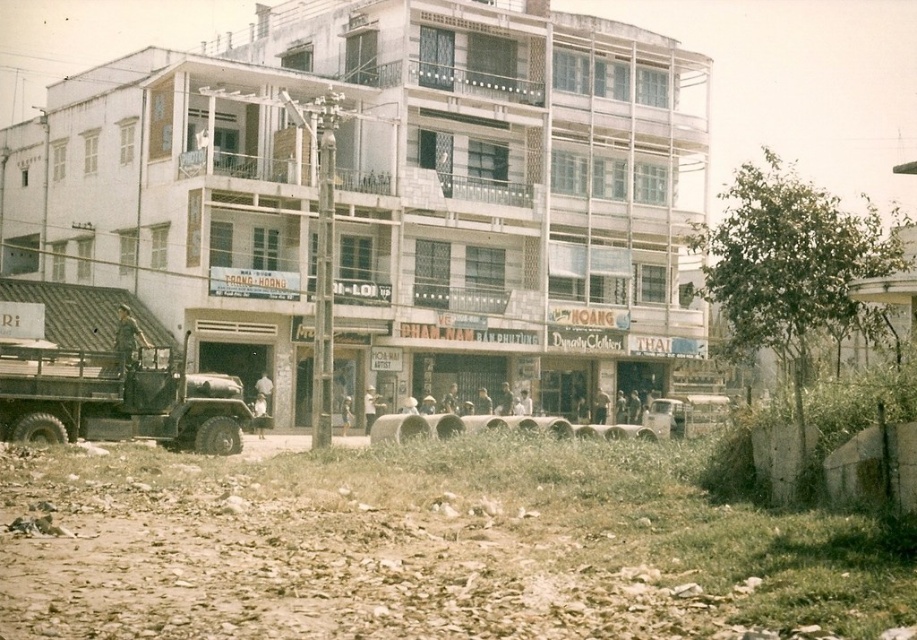
Can you confirm if matte black truck at left is positioned below metallic silver car at center?

No, matte black truck at left is not below metallic silver car at center.

In the scene shown: Who is more distant from viewer, [129,364] or [661,429]?

Positioned behind is point [661,429].

The height and width of the screenshot is (640, 917). Identify the location of matte black truck at left. (116, 401).